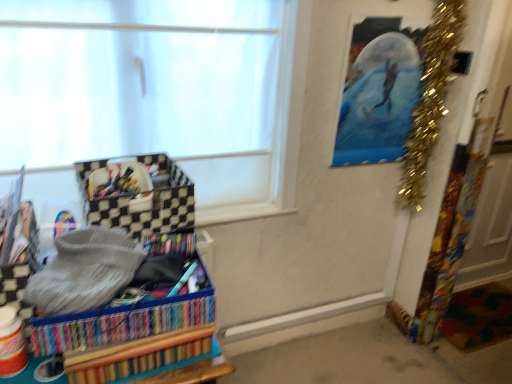
Locate an element on the screen. The width and height of the screenshot is (512, 384). empty space that is ontop of multicolored woven basket at lower left, placed as the second storage box when sorted from top to bottom (from a real-world perspective) is located at coordinates (127, 269).